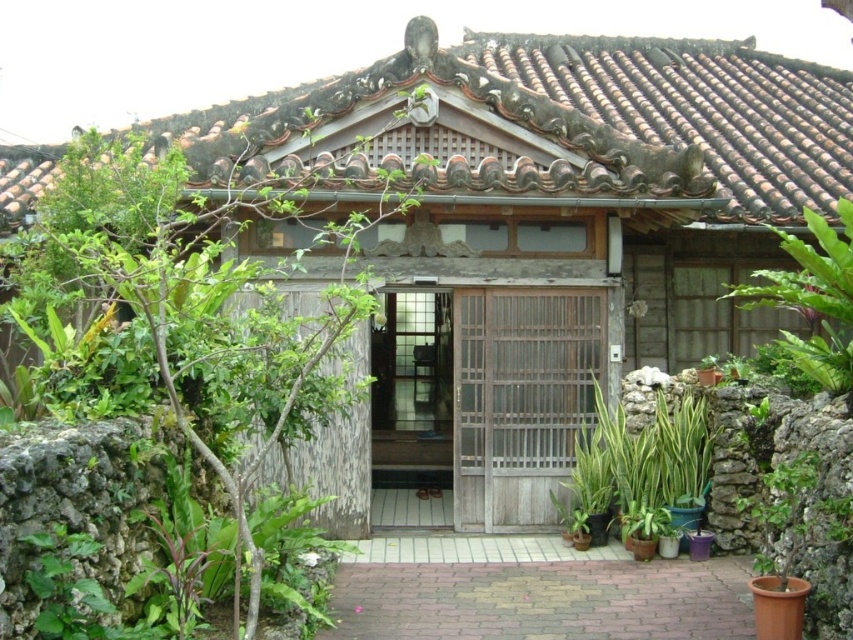
Consider the image. Is weathered wood door at center smaller than green leafy plant at right?

Yes, weathered wood door at center is smaller than green leafy plant at right.

Is weathered wood door at center above green leafy plant at right?

Actually, weathered wood door at center is below green leafy plant at right.

Identify the location of weathered wood door at center. (x=520, y=401).

Does green leafy plant at left have a greater height compared to green leafy plant at center?

Indeed, green leafy plant at left has a greater height compared to green leafy plant at center.

Can you confirm if green leafy plant at left is positioned above green leafy plant at center?

Yes.

Consider the image. Measure the distance between point [201,356] and camera.

A distance of 22.03 feet exists between point [201,356] and camera.

This screenshot has height=640, width=853. I want to click on green leafy plant at left, so click(178, 308).

Does green leafy plant at left have a smaller size compared to green leafy plant at right?

Incorrect, green leafy plant at left is not smaller in size than green leafy plant at right.

How far apart are green leafy plant at left and green leafy plant at right?

green leafy plant at left and green leafy plant at right are 5.71 meters apart from each other.

Which is behind, point (213, 212) or point (822, 298)?

Point (213, 212)

The width and height of the screenshot is (853, 640). I want to click on green leafy plant at left, so click(x=178, y=308).